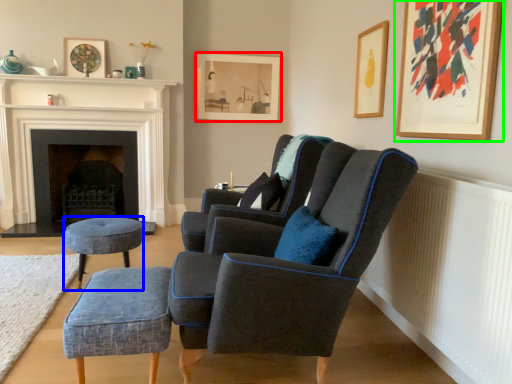
Question: Which object is the farthest from picture frame (highlighted by a red box)? Choose among these: stool (highlighted by a blue box) or picture frame (highlighted by a green box).

Choices:
 (A) stool
 (B) picture frame

Answer: (B)